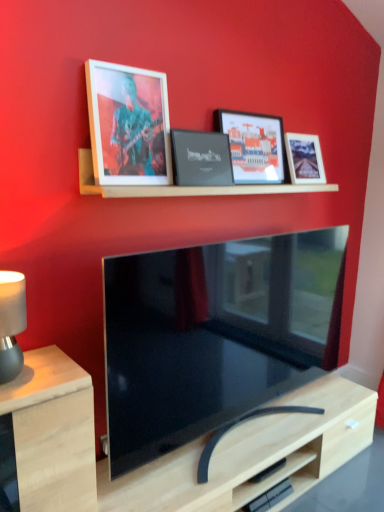
Locate an element on the screen. The height and width of the screenshot is (512, 384). free space above light wood table at lower left (from a real-world perspective) is located at coordinates (37, 371).